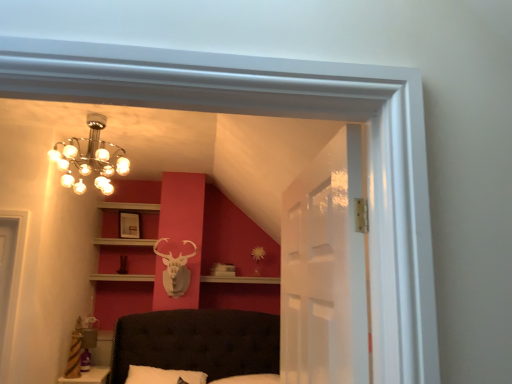
Question: Is metallic chandelier at upper left situated inside matte white picture frame at upper center or outside?

Choices:
 (A) inside
 (B) outside

Answer: (B)

Question: From the image's perspective, relative to matte white picture frame at upper center, is metallic chandelier at upper left above or below?

Choices:
 (A) above
 (B) below

Answer: (A)

Question: Estimate the real-world distances between objects in this image. Which object is closer to the matte white picture frame at upper center?

Choices:
 (A) metallic chandelier at upper left
 (B) transparent glass door at center

Answer: (A)

Question: Which is nearer to the metallic chandelier at upper left?

Choices:
 (A) transparent glass door at center
 (B) matte white picture frame at upper center

Answer: (B)